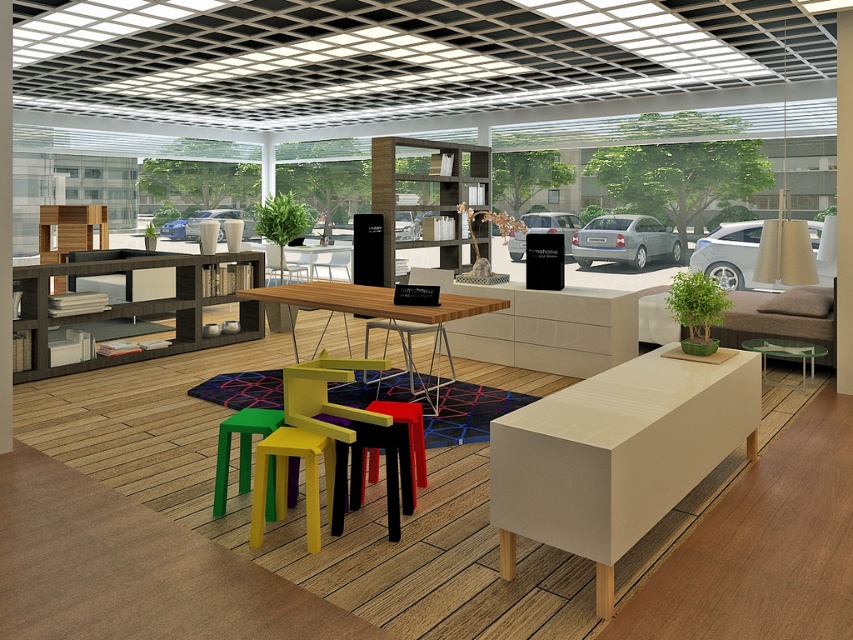
Question: Which object is the closest to the wooden table at center?

Choices:
 (A) yellow matte bar stool at center
 (B) matte black stool at center

Answer: (B)

Question: Does yellow matte chair at center appear over yellow plastic bar stool at center?

Choices:
 (A) yes
 (B) no

Answer: (A)

Question: Among these points, which one is nearest to the camera?

Choices:
 (A) (689, 371)
 (B) (251, 428)

Answer: (B)

Question: Can you confirm if white glossy rectangular table at center is smaller than yellow plastic chair at center?

Choices:
 (A) yes
 (B) no

Answer: (B)

Question: Considering the real-world distances, which object is farthest from the wooden table at center?

Choices:
 (A) yellow plastic bar stool at center
 (B) yellow matte bar stool at center
 (C) yellow matte chair at center
 (D) transparent glass table at center

Answer: (D)

Question: Can you confirm if yellow matte chair at center is positioned above transparent glass table at center?

Choices:
 (A) yes
 (B) no

Answer: (B)